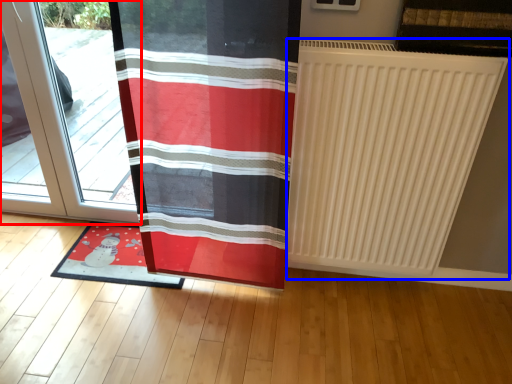
Question: Among these objects, which one is farthest to the camera, door (highlighted by a red box) or radiator (highlighted by a blue box)?

Choices:
 (A) door
 (B) radiator

Answer: (A)